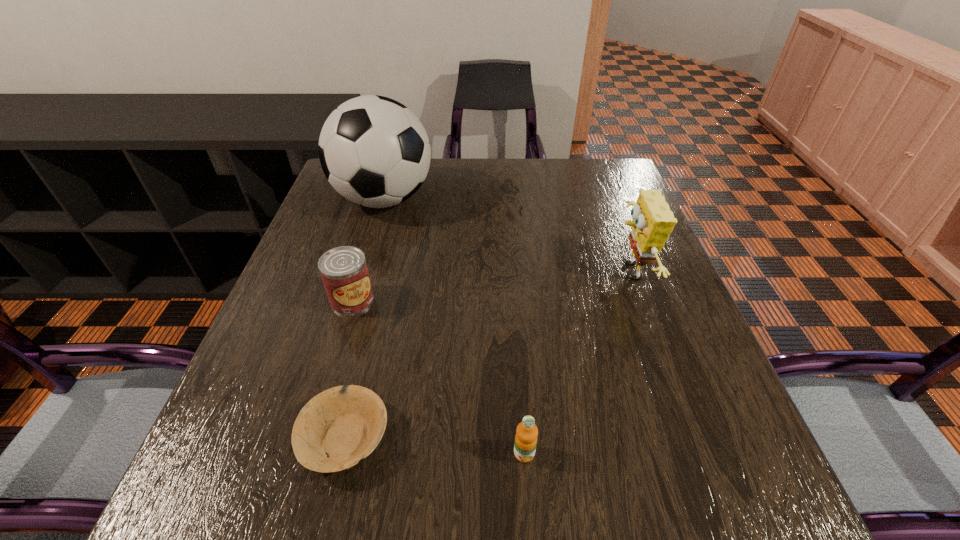
Locate an element on the screen. vacant area located on the face of the sponge is located at coordinates (525, 272).

You are a GUI agent. You are given a task and a screenshot of the screen. Output one action in this format:
    pyautogui.click(x=<x>, y=<y>)
    Task: Click on the vacant space located 0.060m on the right of the can
    
    Given the screenshot: What is the action you would take?
    pyautogui.click(x=401, y=300)

Find the location of a particular element. vacant space situated 0.060m on the label of the second object from right to left is located at coordinates pos(528,504).

Find the location of a particular element. blank area located 0.320m on the back of the bowl is located at coordinates (384, 275).

At what (x,y) coordinates should I click in order to perform the action: click on object at the far edge. Please return your answer as a coordinate pair (x, y). The image size is (960, 540). Looking at the image, I should click on (374, 151).

At what (x,y) coordinates should I click in order to perform the action: click on object that is at the near edge. Please return your answer as a coordinate pair (x, y). The width and height of the screenshot is (960, 540). Looking at the image, I should click on (335, 429).

At what (x,y) coordinates should I click in order to perform the action: click on soccer ball present at the left edge. Please return your answer as a coordinate pair (x, y). The image size is (960, 540). Looking at the image, I should click on (374, 151).

The width and height of the screenshot is (960, 540). In order to click on can at the left edge in this screenshot , I will do point(344,272).

Where is `bowl that is at the left edge`? The height and width of the screenshot is (540, 960). bowl that is at the left edge is located at coordinates (335, 429).

Find the location of a particular element. The height and width of the screenshot is (540, 960). object at the right edge is located at coordinates (653, 221).